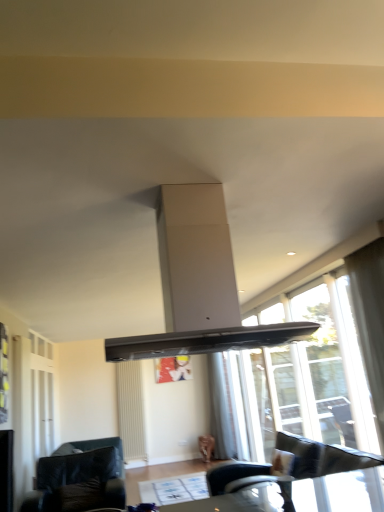
At what (x,y) coordinates should I click in order to perform the action: click on free point above white matte exhaust hood at center (from a real-world perspective). Please return your answer as a coordinate pair (x, y). The height and width of the screenshot is (512, 384). Looking at the image, I should click on (203, 183).